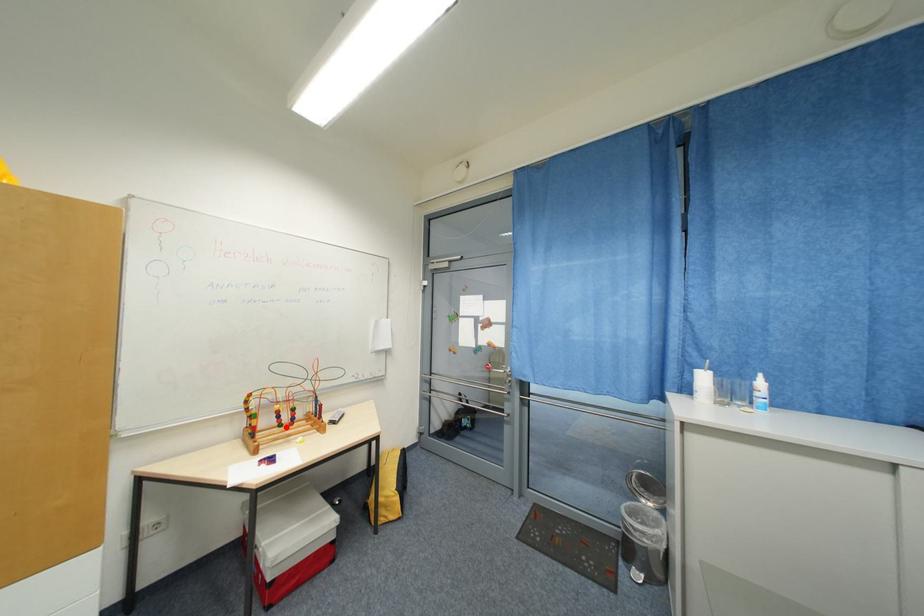
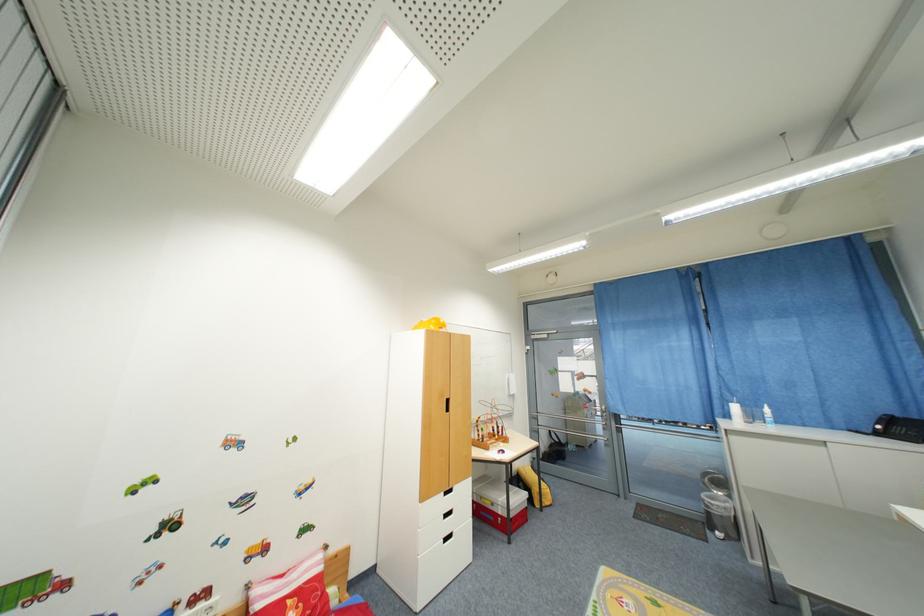
Question: A red point is marked in image1. In image2, is the corresponding 3D point closer to the camera or farther? Reply with the corresponding letter.

Choices:
 (A) The corresponding 3D point is closer.
 (B) The corresponding 3D point is farther.

Answer: (B)